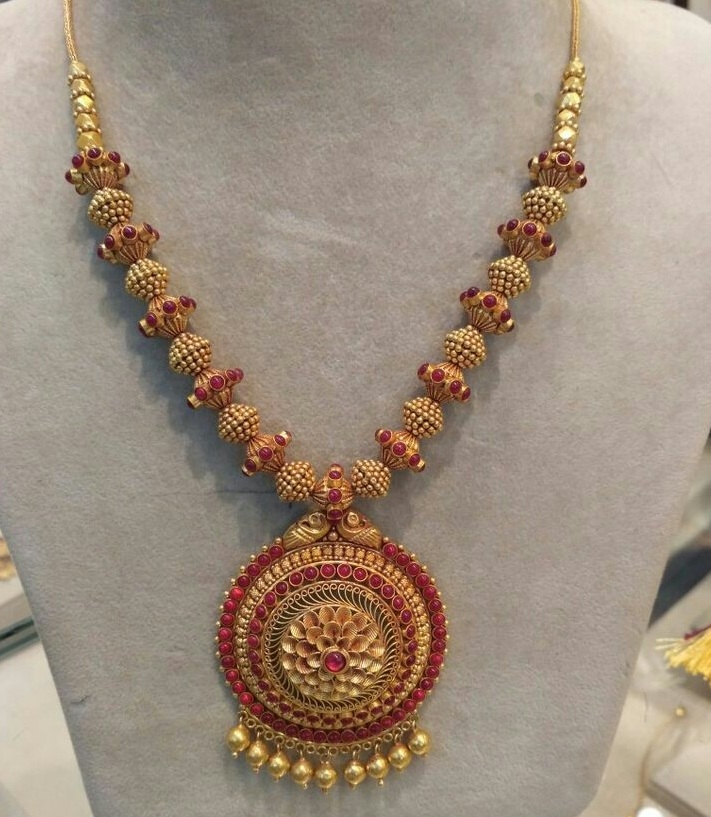
You are a GUI agent. You are given a task and a screenshot of the screen. Output one action in this format:
    pyautogui.click(x=<x>, y=<y>)
    Task: Click on the gold tassle
    
    Given the screenshot: What is the action you would take?
    pyautogui.click(x=697, y=655)